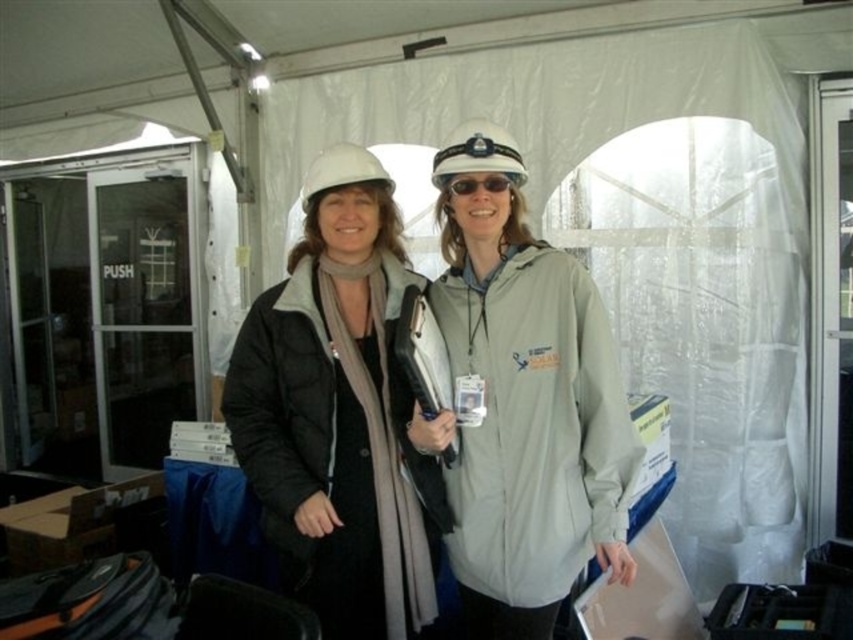
Question: Among these points, which one is nearest to the camera?

Choices:
 (A) (469, 186)
 (B) (354, 609)
 (C) (486, 131)

Answer: (C)

Question: Can you confirm if white matte hard hat at center is positioned above sunglassestransparent at center?

Choices:
 (A) no
 (B) yes

Answer: (B)

Question: Among these points, which one is farthest from the camera?

Choices:
 (A) (467, 141)
 (B) (354, 308)
 (C) (306, 177)

Answer: (C)

Question: Where is matte black jacket at center located in relation to matte white hard hat at center in the image?

Choices:
 (A) left
 (B) right

Answer: (B)

Question: Which is nearer to the matte black jacket at center?

Choices:
 (A) sunglassestransparent at center
 (B) white matte hard hat at center
 (C) matte white hard hat at center

Answer: (B)

Question: Is matte black jacket at center positioned behind white matte hard hat at center?

Choices:
 (A) yes
 (B) no

Answer: (B)